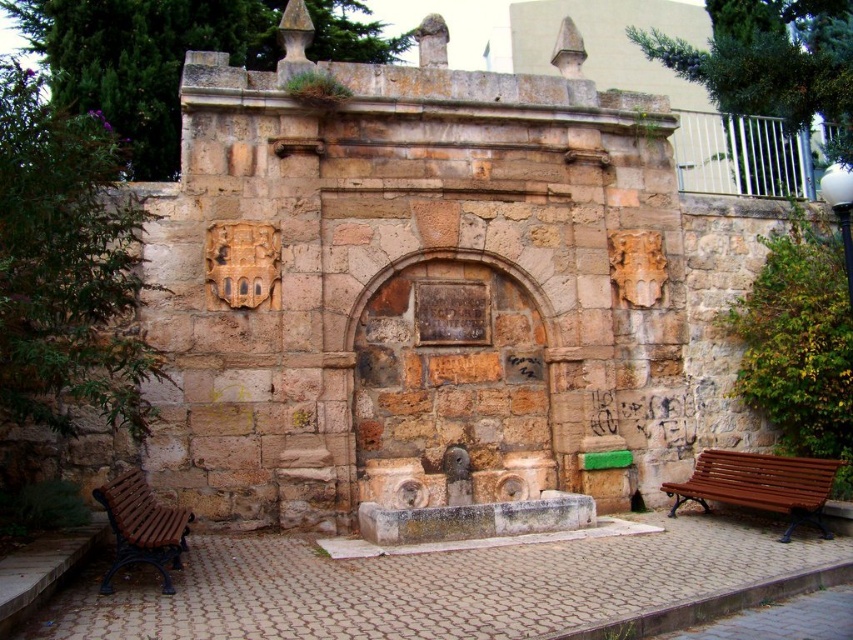
Question: Is brown wooden bench at lower right thinner than brown wooden bench at lower left?

Choices:
 (A) yes
 (B) no

Answer: (B)

Question: Does brown wooden bench at lower right appear over brown wooden bench at lower left?

Choices:
 (A) no
 (B) yes

Answer: (A)

Question: Which point is closer to the camera?

Choices:
 (A) brown wooden bench at lower right
 (B) brown wooden bench at lower left

Answer: (B)

Question: Is brown wooden bench at lower right wider than brown wooden bench at lower left?

Choices:
 (A) yes
 (B) no

Answer: (A)

Question: Which object appears farthest from the camera in this image?

Choices:
 (A) brown wooden bench at lower right
 (B) brown wooden bench at lower left

Answer: (A)